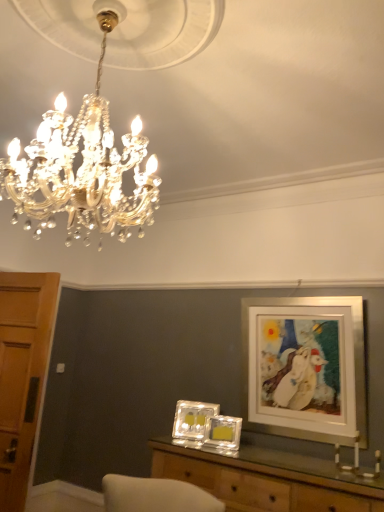
Question: Can you confirm if clear glass picture frame at center, the 1th picture frame positioned from the left, is smaller than translucent glass picture frame at center, which appears as the 2th picture frame when viewed from the right?

Choices:
 (A) no
 (B) yes

Answer: (A)

Question: Does clear glass picture frame at center, the 1th picture frame positioned from the left, appear on the right side of translucent glass picture frame at center, which appears as the 2th picture frame when viewed from the right?

Choices:
 (A) no
 (B) yes

Answer: (A)

Question: From the image's perspective, does clear glass picture frame at center, the 1th picture frame positioned from the left, appear lower than translucent glass picture frame at center, the 2th picture frame viewed from the left?

Choices:
 (A) yes
 (B) no

Answer: (A)

Question: Does clear glass picture frame at center, the 1th picture frame positioned from the left, have a lesser width compared to translucent glass picture frame at center, the 2th picture frame viewed from the left?

Choices:
 (A) no
 (B) yes

Answer: (A)

Question: Is the depth of clear glass picture frame at center, the 1th picture frame positioned from the left, less than that of translucent glass picture frame at center, which appears as the 2th picture frame when viewed from the right?

Choices:
 (A) no
 (B) yes

Answer: (A)

Question: Can you confirm if clear glass picture frame at center, arranged as the third picture frame when viewed from the right, is positioned to the left of translucent glass picture frame at center, which appears as the 2th picture frame when viewed from the right?

Choices:
 (A) yes
 (B) no

Answer: (A)

Question: From a real-world perspective, is wooden door at left physically above white matte picture frame at upper right, the first picture frame from the right?

Choices:
 (A) no
 (B) yes

Answer: (A)

Question: From the image's perspective, would you say wooden door at left is shown under white matte picture frame at upper right, the first picture frame from the right?

Choices:
 (A) yes
 (B) no

Answer: (A)

Question: Is wooden door at left shorter than white matte picture frame at upper right, the 3th picture frame viewed from the left?

Choices:
 (A) no
 (B) yes

Answer: (A)

Question: Does wooden door at left lie in front of white matte picture frame at upper right, the 3th picture frame viewed from the left?

Choices:
 (A) no
 (B) yes

Answer: (B)

Question: From the image's perspective, is wooden door at left located above white matte picture frame at upper right, the 3th picture frame viewed from the left?

Choices:
 (A) no
 (B) yes

Answer: (A)

Question: Is wooden door at left further to camera compared to white matte picture frame at upper right, the 3th picture frame viewed from the left?

Choices:
 (A) yes
 (B) no

Answer: (B)

Question: Is wooden table at center in front of wooden door at left?

Choices:
 (A) yes
 (B) no

Answer: (A)